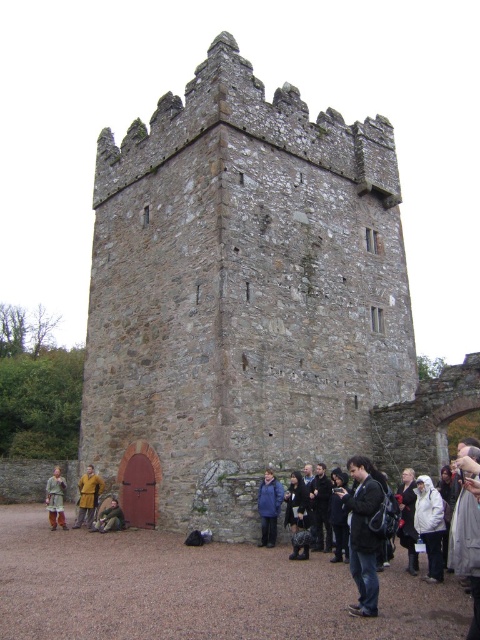
Question: Which object appears farthest from the camera in this image?

Choices:
 (A) blue woolen coat at center
 (B) brown leather jacket at lower center
 (C) brown leather jacket at lower left

Answer: (C)

Question: Which point appears closest to the camera in this image?

Choices:
 (A) (277, 480)
 (B) (444, 520)
 (C) (364, 550)
 (D) (399, 529)

Answer: (C)

Question: Does white woolen sweater at lower right appear over blue woolen coat at center?

Choices:
 (A) no
 (B) yes

Answer: (B)

Question: Observing the image, what is the correct spatial positioning of dark gray wool coat at lower right in reference to black leather jacket at lower right?

Choices:
 (A) above
 (B) below

Answer: (B)

Question: Is golden-yellow wool coat at lower left further to camera compared to brown leather jacket at lower center?

Choices:
 (A) no
 (B) yes

Answer: (B)

Question: Based on their relative distances, which object is nearer to the dark gray wool coat at lower right?

Choices:
 (A) golden-yellow wool coat at lower left
 (B) white woolen sweater at lower right
 (C) black leather jacket at lower right

Answer: (C)